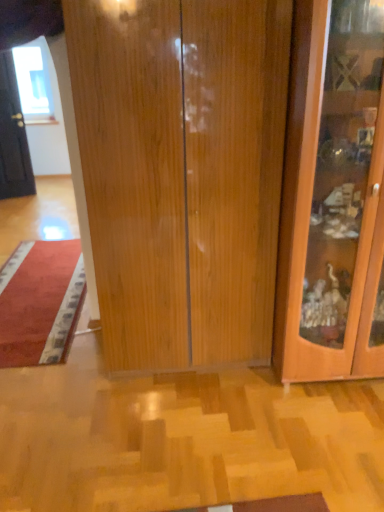
Measure the distance between black matte door at left and camera.

black matte door at left and camera are 4.57 meters apart from each other.

Where is `black matte door at left`? Image resolution: width=384 pixels, height=512 pixels. black matte door at left is located at coordinates (13, 136).

The image size is (384, 512). What do you see at coordinates (13, 136) in the screenshot?
I see `black matte door at left` at bounding box center [13, 136].

Where is `black matte door at left`? black matte door at left is located at coordinates (13, 136).